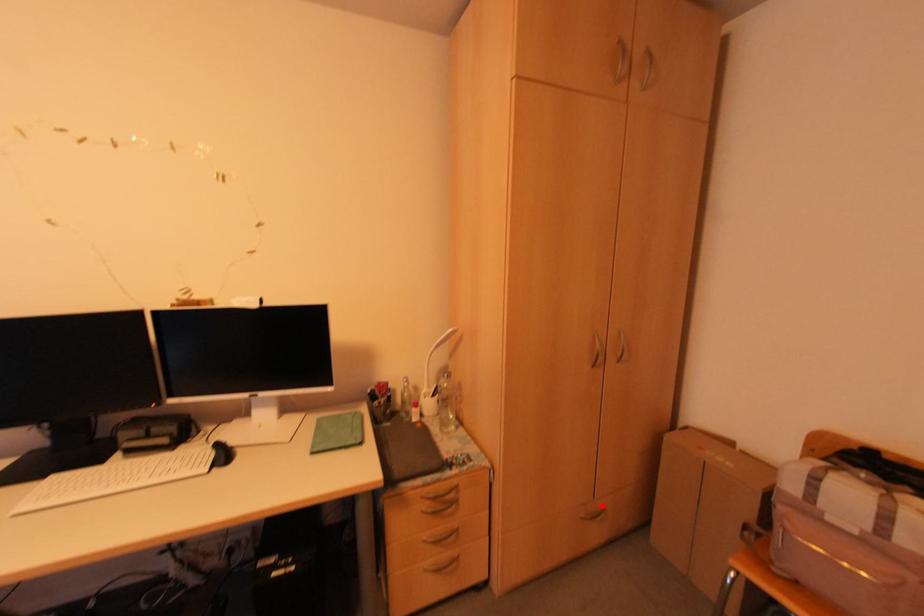
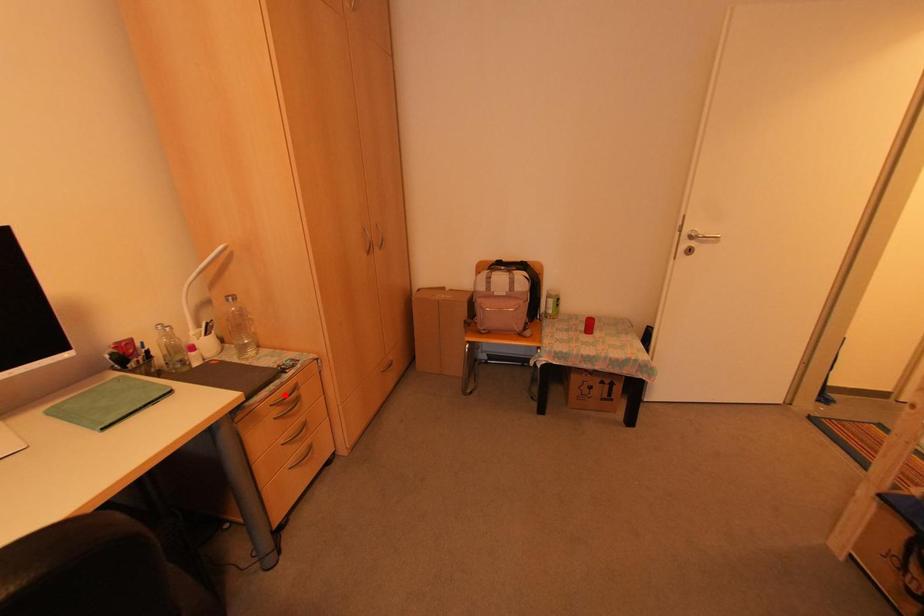
Based on the photo, I am providing you with two images of the same scene from different viewpoints. A red point is marked on the first image and another point is marked on the second image. Is the marked point in image1 the same physical position as the marked point in image2?

No